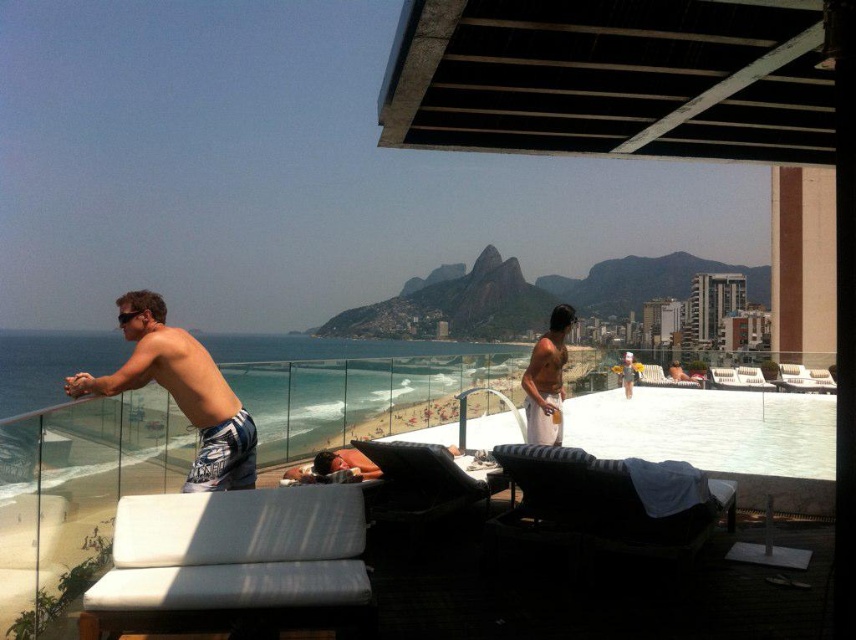
You are a guest staying at this rooftop terrace and want to place your white cotton shorts at center on the black striped daybed at lower right. Can you do this without any issues?

The black striped daybed at lower right has a greater height compared to white cotton shorts at center. Since the daybed is taller, placing the shorts on it should be possible as there is no height restriction mentioned for the shorts.

You are a guest staying at this rooftop terrace and want to take a photo of the white textured shorts at left from the black striped daybed at lower right. Will the mountain in the distance be visible in the photo?

The black striped daybed at lower right is further to the viewer than white textured shorts at left, so when taking a photo from the daybed towards the shorts, the mountain in the distance will still be visible behind the shorts as it is part of the background scenery.

You are a photographer on the rooftop terrace and want to capture both the white textured shorts at left and the white cotton shorts at center in a single photo. Since you can only focus on one subject at a time, which one should you choose to ensure the other remains visible in the background?

You should focus on the white textured shorts at left because it is in front of the white cotton shorts at center, so the latter will naturally appear in the background.